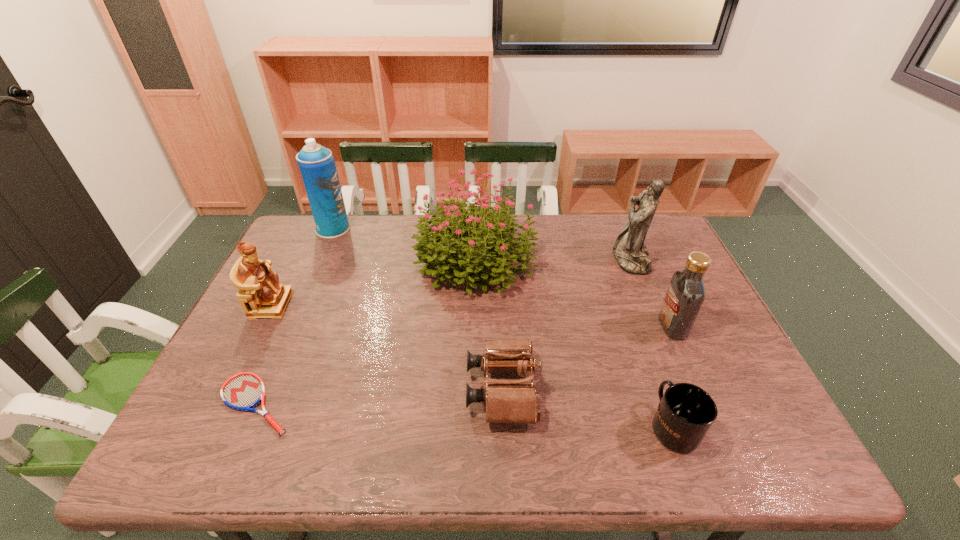
Where is `vacant point located through the eyepieces of the binoculars`? vacant point located through the eyepieces of the binoculars is located at coordinates [437, 389].

In order to click on vacant area situated through the eyepieces of the binoculars in this screenshot , I will do `click(311, 389)`.

Find the location of a particular element. The width and height of the screenshot is (960, 540). vacant region located with the handle on the side of the mug is located at coordinates (637, 328).

Find the location of a particular element. blank space located 0.340m with the handle on the side of the mug is located at coordinates (626, 296).

Locate an element on the screen. The width and height of the screenshot is (960, 540). vacant space situated with the handle on the side of the mug is located at coordinates (634, 316).

Find the location of a particular element. Image resolution: width=960 pixels, height=540 pixels. free space located on the right of the tennis racket is located at coordinates (403, 404).

The image size is (960, 540). I want to click on aerosol can present at the far edge, so click(x=317, y=165).

Locate an element on the screen. This screenshot has height=540, width=960. bouquet positioned at the far edge is located at coordinates 489,243.

You are a GUI agent. You are given a task and a screenshot of the screen. Output one action in this format:
    pyautogui.click(x=<x>, y=<y>)
    Task: Click on the figurine that is at the far edge
    The width and height of the screenshot is (960, 540).
    Given the screenshot: What is the action you would take?
    pyautogui.click(x=629, y=250)

The height and width of the screenshot is (540, 960). In order to click on binoculars positioned at the near edge in this screenshot , I will do `click(507, 401)`.